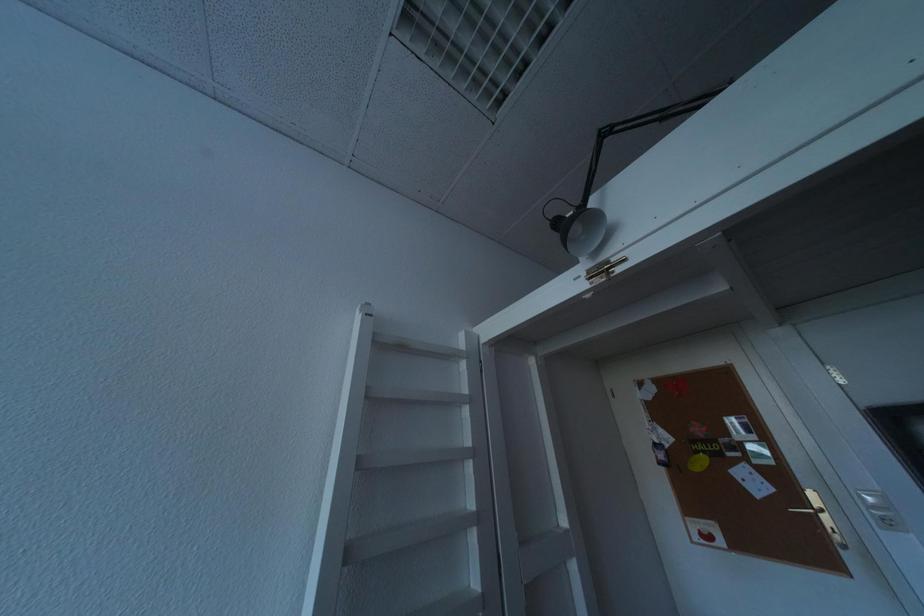
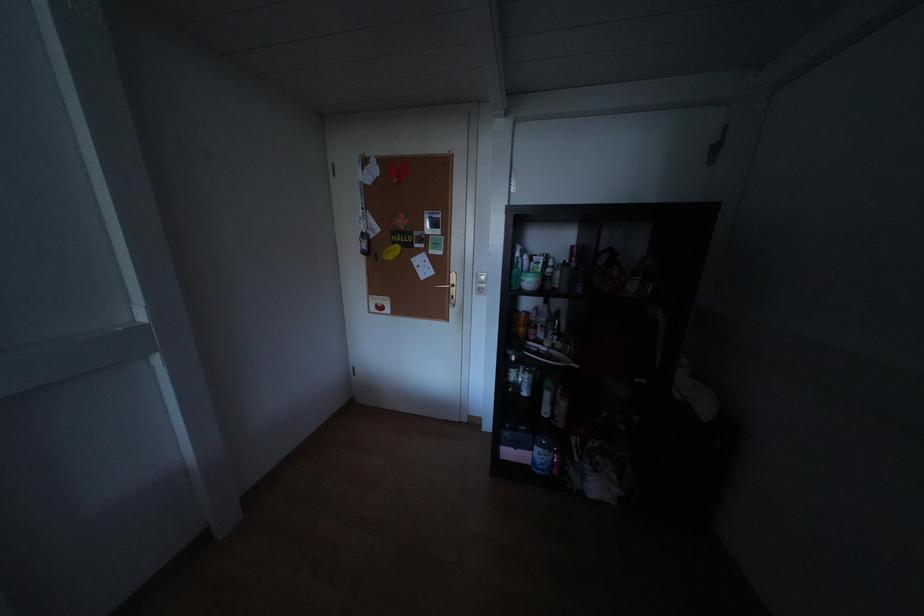
In the scene shown: How did the camera likely rotate?

The rotation direction of the camera is right-down.